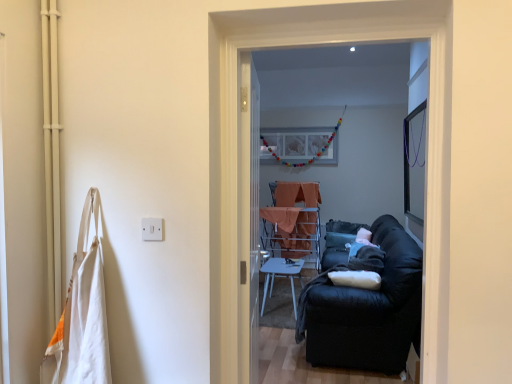
Question: Is black fabric couch at right touching white glossy table at center?

Choices:
 (A) yes
 (B) no

Answer: (B)

Question: Is black fabric couch at right closer to camera compared to white glossy table at center?

Choices:
 (A) yes
 (B) no

Answer: (A)

Question: Does black fabric couch at right have a lesser width compared to white glossy table at center?

Choices:
 (A) no
 (B) yes

Answer: (A)

Question: Would you say black fabric couch at right contains white glossy table at center?

Choices:
 (A) no
 (B) yes

Answer: (A)

Question: Are black fabric couch at right and white glossy table at center located far from each other?

Choices:
 (A) yes
 (B) no

Answer: (A)

Question: From the image's perspective, is black fabric couch at right above or below white glossy table at center?

Choices:
 (A) below
 (B) above

Answer: (B)

Question: Considering the positions of point (384, 243) and point (271, 281), is point (384, 243) closer or farther from the camera than point (271, 281)?

Choices:
 (A) farther
 (B) closer

Answer: (B)

Question: Is black fabric couch at right taller or shorter than white glossy table at center?

Choices:
 (A) short
 (B) tall

Answer: (B)

Question: In terms of width, does black fabric couch at right look wider or thinner when compared to white glossy table at center?

Choices:
 (A) wide
 (B) thin

Answer: (A)

Question: Considering their positions, is white cotton bag at left located in front of or behind matte white picture frame at center?

Choices:
 (A) front
 (B) behind

Answer: (A)

Question: Is white cotton bag at left bigger or smaller than matte white picture frame at center?

Choices:
 (A) small
 (B) big

Answer: (A)

Question: Is white cotton bag at left inside the boundaries of matte white picture frame at center, or outside?

Choices:
 (A) outside
 (B) inside

Answer: (A)

Question: Considering the positions of white cotton bag at left and matte white picture frame at center in the image, is white cotton bag at left taller or shorter than matte white picture frame at center?

Choices:
 (A) short
 (B) tall

Answer: (B)

Question: In the image, is clear glass screen door at center, the first screen door from the back, positioned in front of or behind white glossy table at center?

Choices:
 (A) front
 (B) behind

Answer: (A)

Question: From their relative heights in the image, would you say clear glass screen door at center, acting as the second screen door starting from the front, is taller or shorter than white glossy table at center?

Choices:
 (A) tall
 (B) short

Answer: (A)